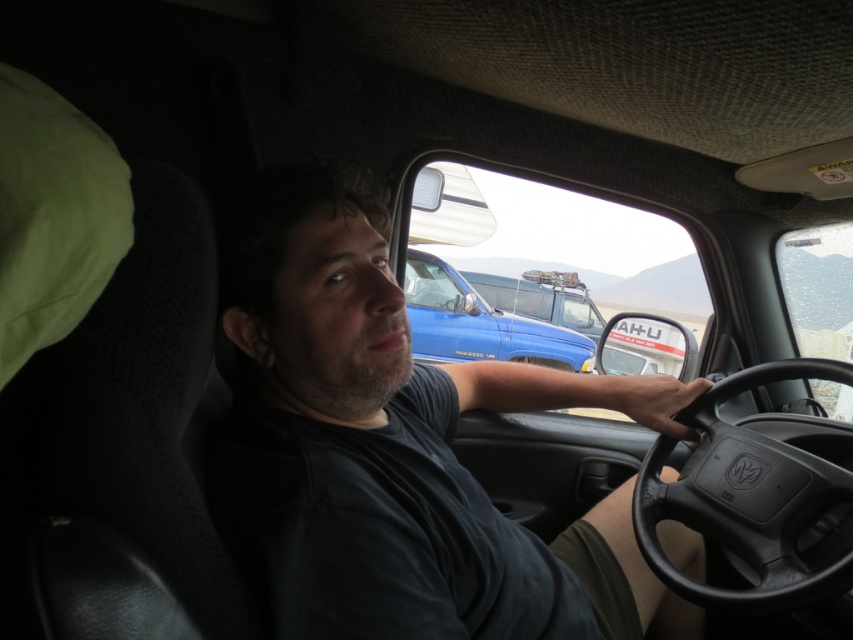
You are a passenger in the car and want to compare the height of the black leather steering wheel at center and the matte blue truck at center. Which one is taller?

The black leather steering wheel at center has a lesser height compared to matte blue truck at center, so the matte blue truck at center is taller.

You are a delivery person who needs to hand over a package to the driver wearing a dark gray shirt at center. The package is 12 inches long. Can you safely hand over the package without it touching the steering wheel?

The dark gray shirt at center is 28.57 inches away from the steering wheel. Since the package is only 12 inches long, there is enough space to hand it over safely without touching the steering wheel.

You are sitting in the passenger seat of the car and want to hand a map to the driver wearing the dark gray shirt at center. The map is on the dashboard near the black leather steering wheel at center. Can you reach the map without leaving your seat?

The dark gray shirt at center is closer to the viewer than the black leather steering wheel at center, so the driver is closer to the map. You might need to ask the driver to hand you the map first before giving them the map.